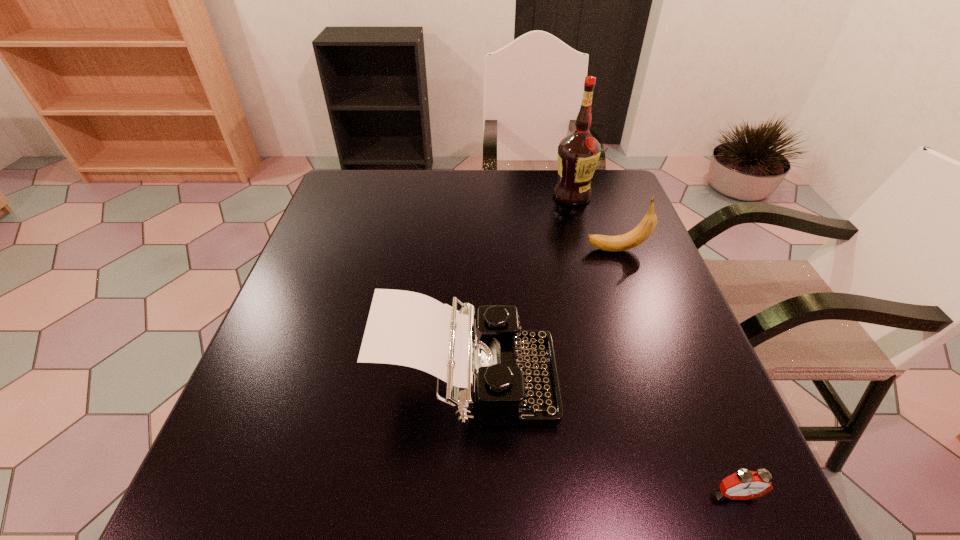
The width and height of the screenshot is (960, 540). Identify the location of vacant region located at the start of the peel on the second farthest object. [x=444, y=250].

Where is `vacant space located at the start of the peel on the second farthest object`? The height and width of the screenshot is (540, 960). vacant space located at the start of the peel on the second farthest object is located at coordinates (468, 250).

Where is `object that is at the far edge`? object that is at the far edge is located at coordinates (578, 153).

You are a GUI agent. You are given a task and a screenshot of the screen. Output one action in this format:
    pyautogui.click(x=<x>, y=<y>)
    Task: Click on the object present at the near edge
    This screenshot has width=960, height=540.
    Given the screenshot: What is the action you would take?
    pyautogui.click(x=743, y=485)

You are a GUI agent. You are given a task and a screenshot of the screen. Output one action in this format:
    pyautogui.click(x=<x>, y=<y>)
    Task: Click on the alcohol located in the right edge section of the desktop
    This screenshot has width=960, height=540.
    Given the screenshot: What is the action you would take?
    pyautogui.click(x=578, y=153)

The height and width of the screenshot is (540, 960). In order to click on banana that is at the right edge in this screenshot , I will do click(x=645, y=228).

This screenshot has height=540, width=960. In order to click on alarm clock positioned at the right edge in this screenshot , I will do `click(743, 485)`.

Where is `object that is at the far right corner`? object that is at the far right corner is located at coordinates (578, 153).

Find the location of `object situated at the near right corner`. object situated at the near right corner is located at coordinates (743, 485).

The image size is (960, 540). Find the location of `vacant region at the far edge of the desktop`. vacant region at the far edge of the desktop is located at coordinates (537, 209).